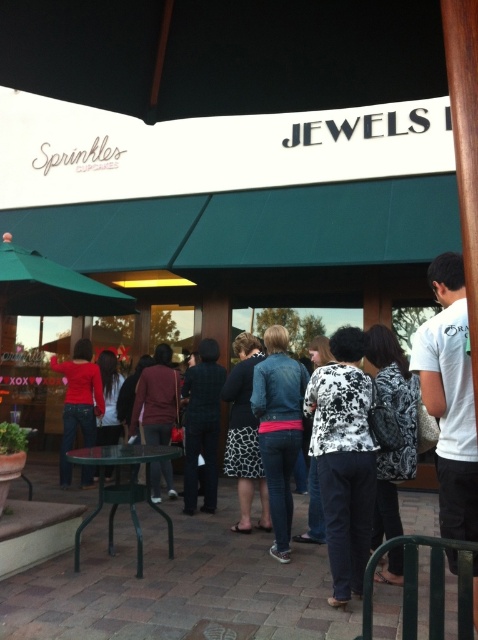
Question: Is black floral shirt at center above denim jacket at center?

Choices:
 (A) no
 (B) yes

Answer: (B)

Question: Which point appears closest to the camera in this image?

Choices:
 (A) (139, 387)
 (B) (252, 486)
 (C) (85, 339)
 (D) (209, 428)

Answer: (B)

Question: From the image, what is the correct spatial relationship of black floral shirt at center in relation to printed fabric skirt at center?

Choices:
 (A) above
 (B) below

Answer: (A)

Question: Which of the following is the farthest from the observer?

Choices:
 (A) maroon sweater at center
 (B) patterned fabric backpack at center
 (C) denim jacket at center

Answer: (A)

Question: Which of these objects is positioned closest to the black floral shirt at center?

Choices:
 (A) patterned fabric backpack at center
 (B) matte red shirt at center

Answer: (A)

Question: Is denim jacket at center positioned before green metal table at lower left?

Choices:
 (A) no
 (B) yes

Answer: (A)